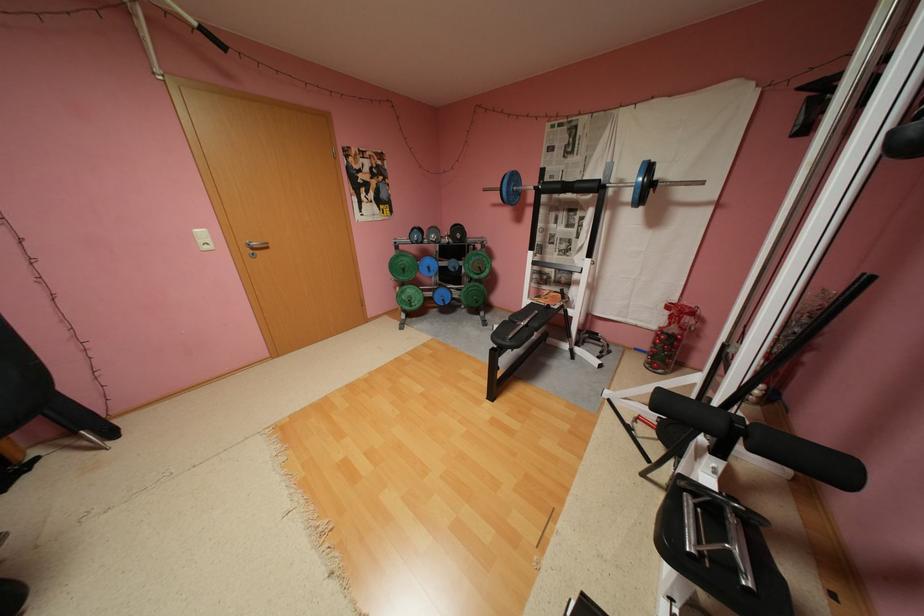
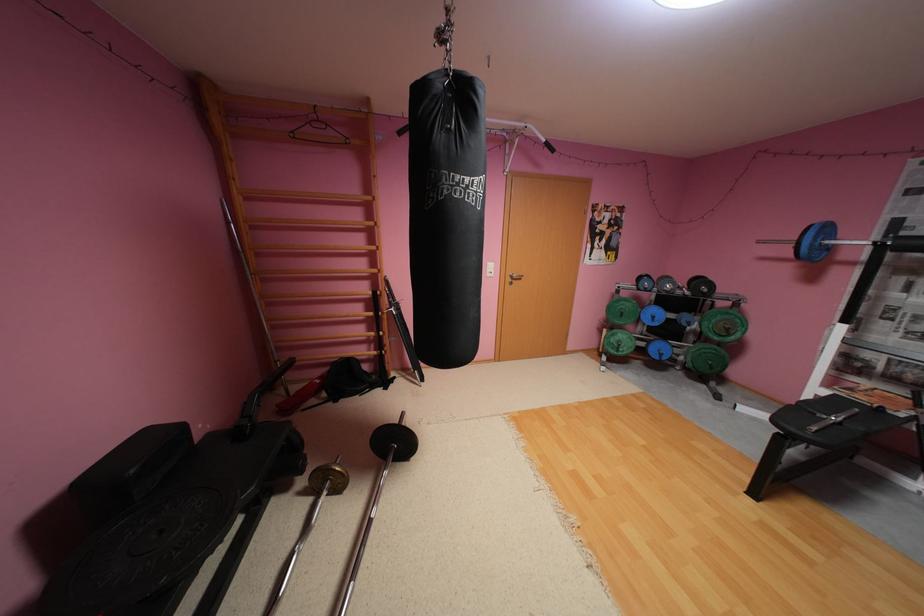
Where in the second image is the point corresponding to pixel 419 306 from the first image?

(626, 351)